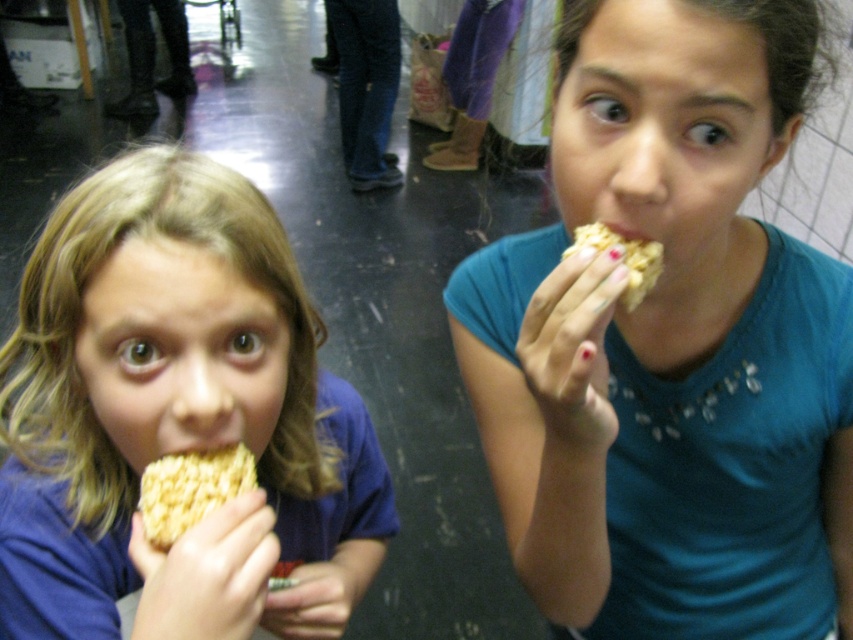
You are standing at the origin point in the image. You want to walk to the point labeled point (791,618). However, there is an obstacle at point (238,488). Will you need to go around the obstacle to reach your destination?

Yes, you will need to go around the obstacle at point (238,488) because point (791,618) is behind it from your starting position at the origin.

You are a food critic visiting this event and see the matte yellow rice krispie treat at left and the yellow crumbly snack at lower left. Which snack do you think has a larger size?

The matte yellow rice krispie treat at left is bigger than the yellow crumbly snack at lower left, so the matte yellow rice krispie treat at left has a larger size.

You are a food critic attending a bake sale and see the matte yellow rice krispie treat at left and the yellow crumbly snack at lower left. Which one is positioned more to the left side of the image?

The matte yellow rice krispie treat at left is positioned more to the left side of the image than the yellow crumbly snack at lower left.